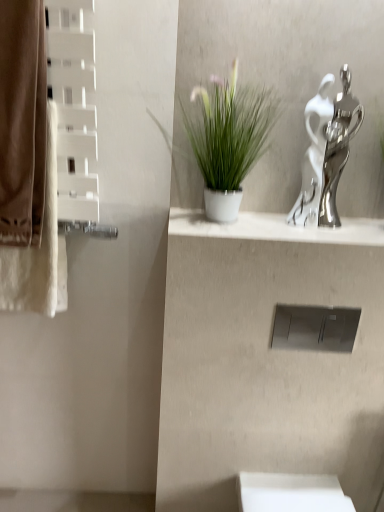
Identify the location of vacant space underneath green matte plant at center (from a real-world perspective). (221, 217).